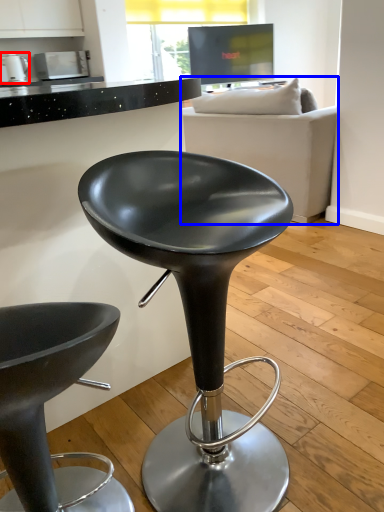
Question: Which point is closer to the camera, appliance (highlighted by a red box) or studio couch (highlighted by a blue box)?

Choices:
 (A) appliance
 (B) studio couch

Answer: (B)